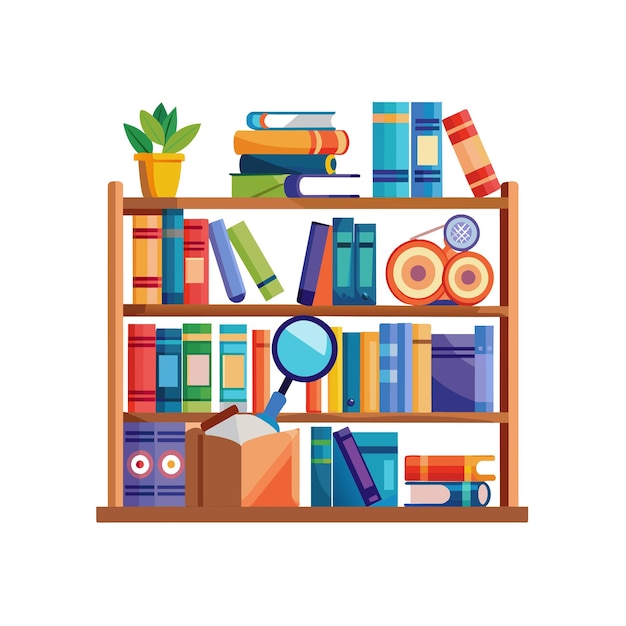
Identify the location of book on top shelf. (461, 140), (429, 141), (396, 146), (298, 116), (297, 141), (298, 163), (289, 183).